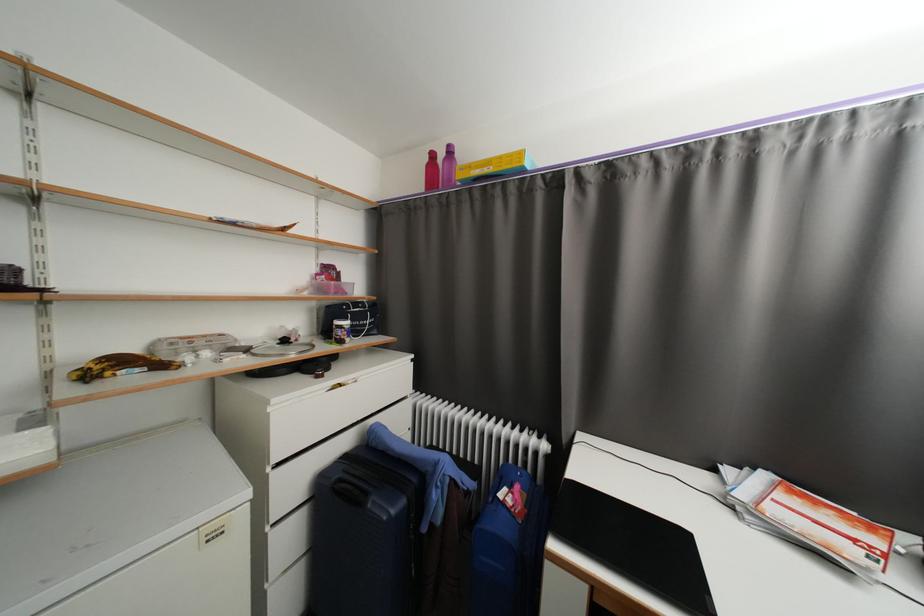
Where would you lift the overripe bananas? Please return your answer as a coordinate pair (x, y).

(118, 367)